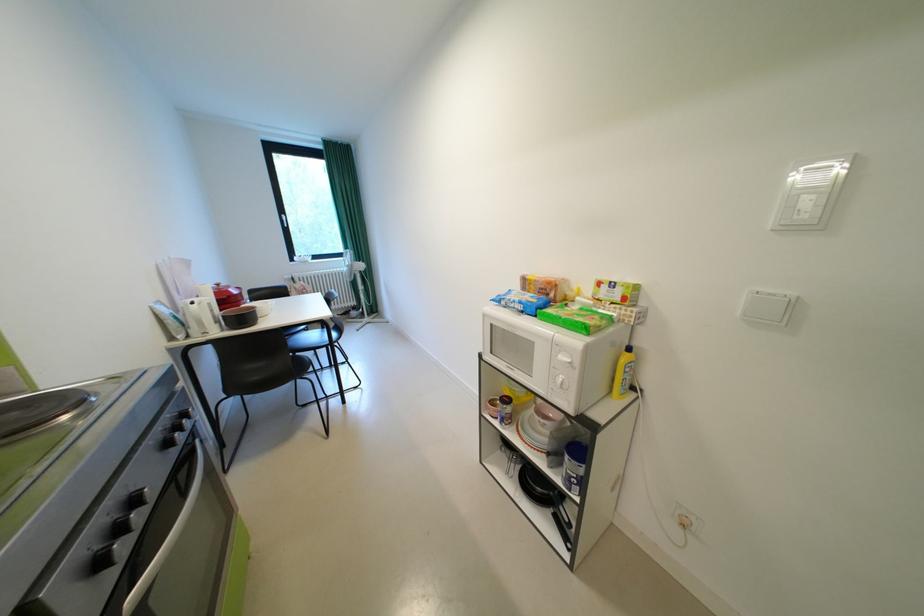
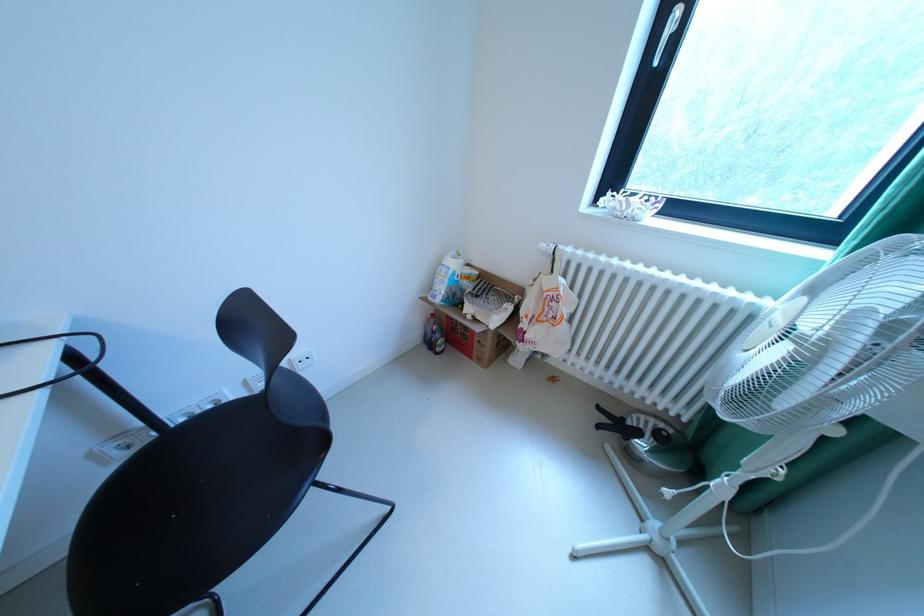
The point at (x=297, y=277) is marked in the first image. Where is the corresponding point in the second image?

(553, 246)